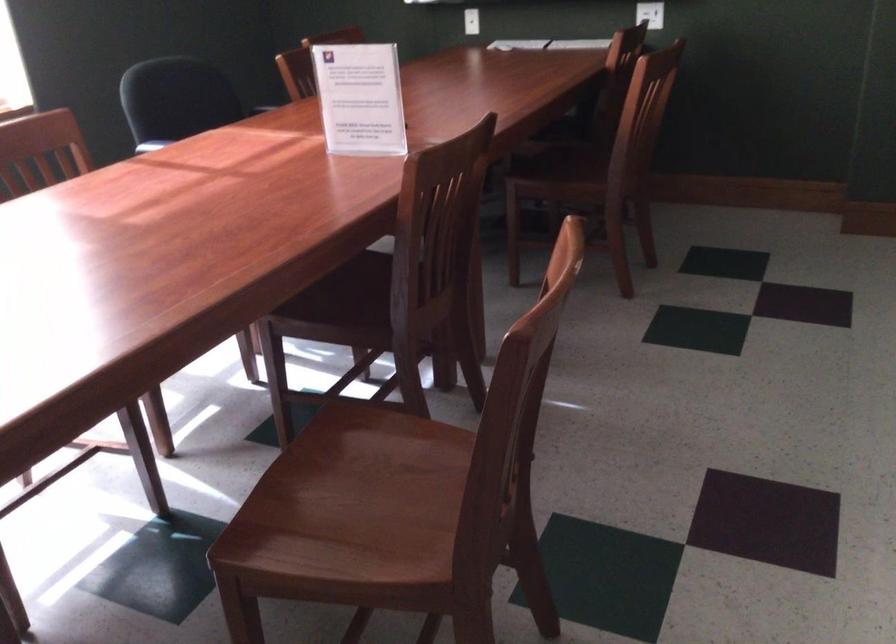
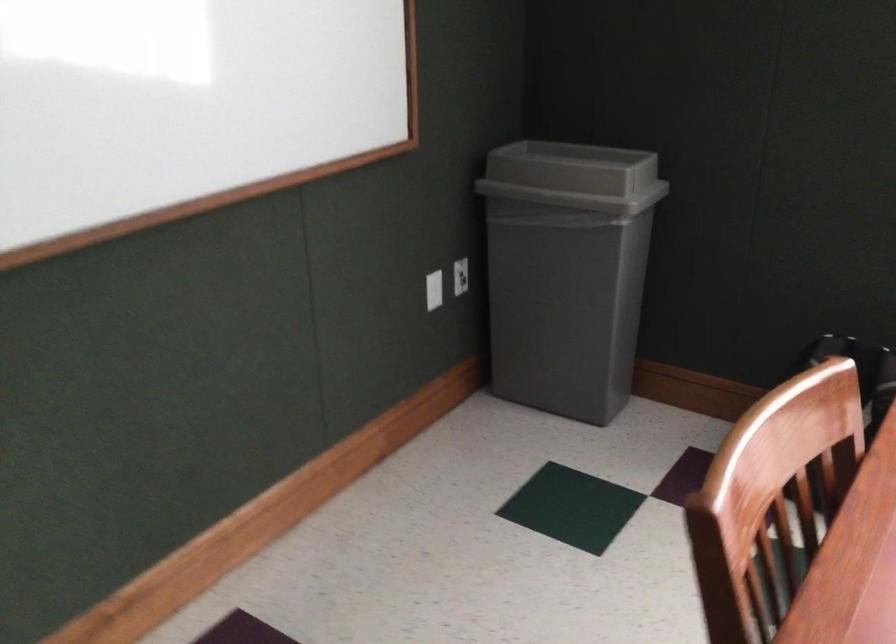
Based on the continuous images, in which direction is the camera rotating?

The camera's rotation is toward left-down.